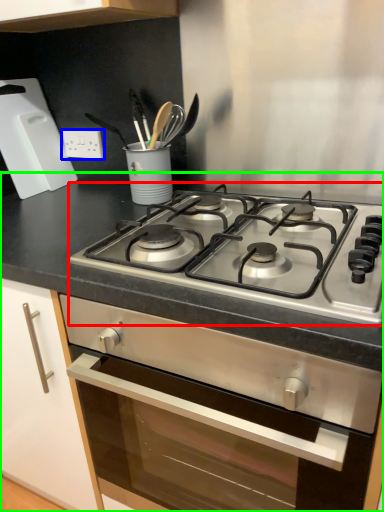
Question: Considering the real-world distances, which object is farthest from gas stove (highlighted by a red box)? electric outlet (highlighted by a blue box) or countertop (highlighted by a green box)?

Choices:
 (A) electric outlet
 (B) countertop

Answer: (A)